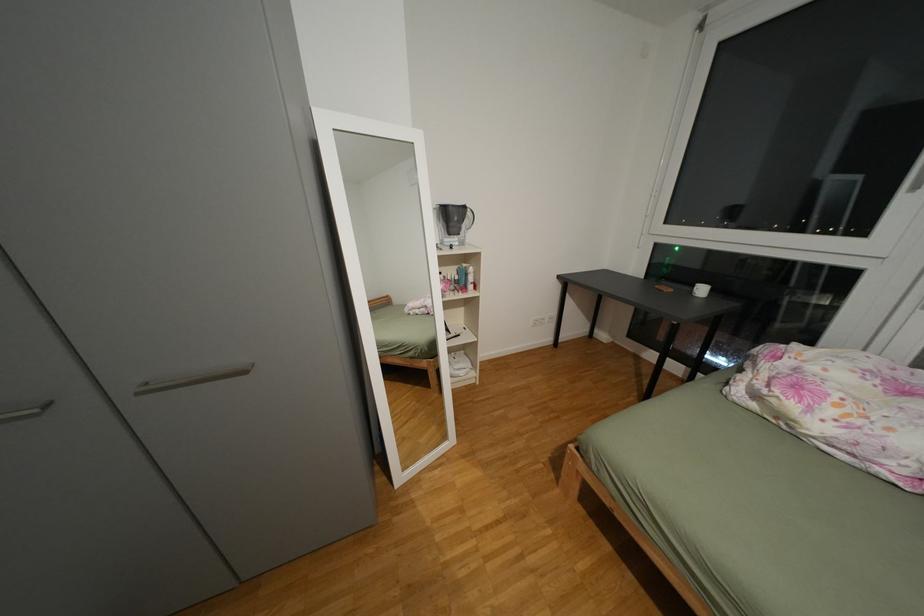
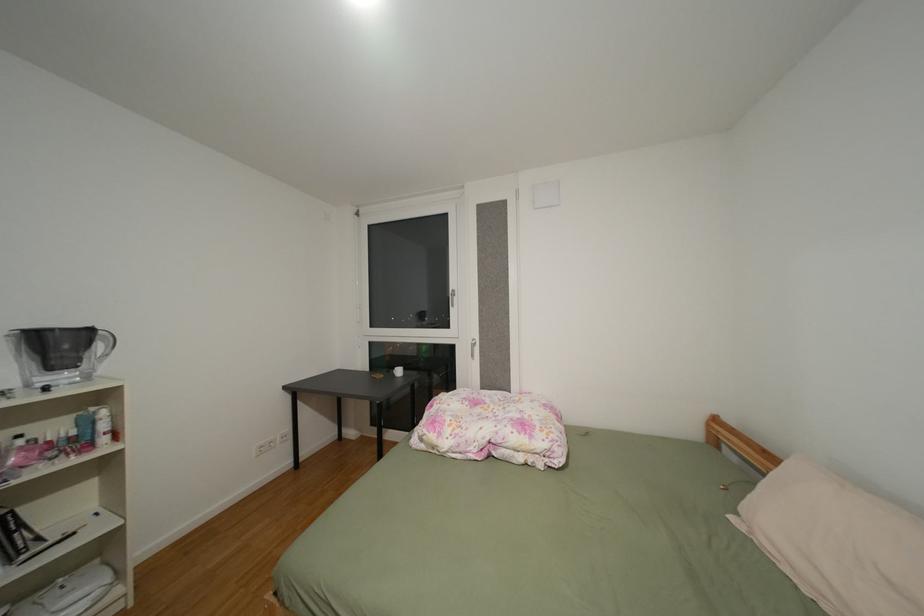
Question: Based on the continuous images, in which direction is the camera rotating? Reply with the corresponding letter.

Choices:
 (A) Left
 (B) Right
 (C) Up
 (D) Down

Answer: (B)